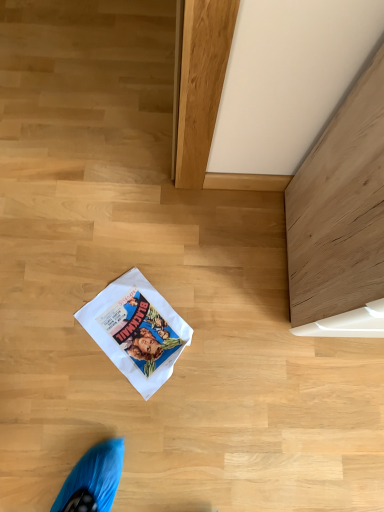
I want to click on free point in front of white paper comic book at center, so click(x=114, y=416).